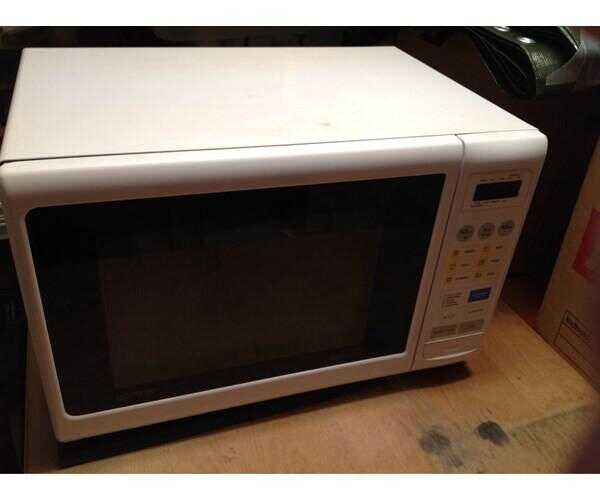
You are a GUI agent. You are given a task and a screenshot of the screen. Output one action in this format:
    pyautogui.click(x=<x>, y=<y>)
    Task: Click on the 1 wooden surface
    The width and height of the screenshot is (600, 500).
    Given the screenshot: What is the action you would take?
    pyautogui.click(x=515, y=406)